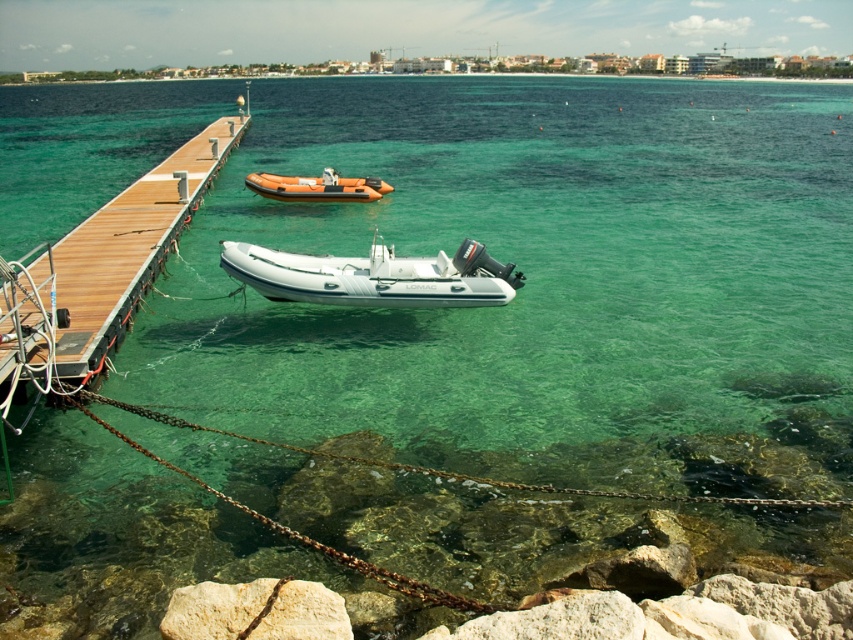
You are standing on the wooden pier and want to move from point A to point B. Point A is at coordinates point (138,298) and point B is at coordinates point (218,620). According to the scene description, which direction should you face to move from point A to point B?

To move from point A at coordinates point (138,298) to point B at coordinates point (218,620), you should face towards the direction of the orange boat since point A is behind point B.

You are standing at the origin point of the image. Which object is located at point (99, 272)?

The wooden dock at left is located at point (99, 272).

You are planning to dock your new boat at the wooden dock at left or the white rubber boat at center. Which location can accommodate a larger vessel?

The wooden dock at left is larger in size than the white rubber boat at center, so it can accommodate a larger vessel.